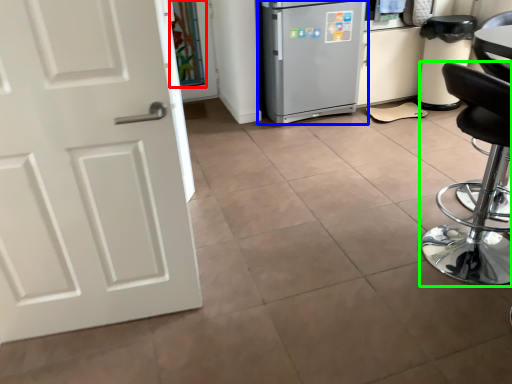
Question: Estimate the real-world distances between objects in this image. Which object is farther from glass door (highlighted by a red box), refrigerator (highlighted by a blue box) or chair (highlighted by a green box)?

Choices:
 (A) refrigerator
 (B) chair

Answer: (B)